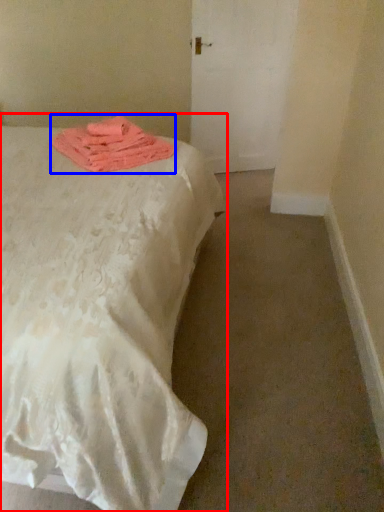
Question: Which object is closer to the camera taking this photo, bed (highlighted by a red box) or cloth (highlighted by a blue box)?

Choices:
 (A) bed
 (B) cloth

Answer: (A)